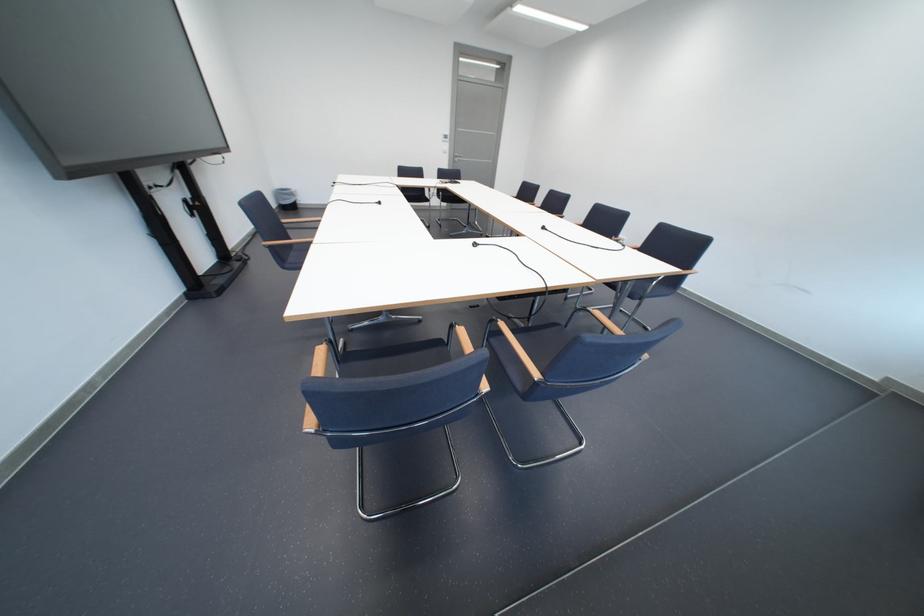
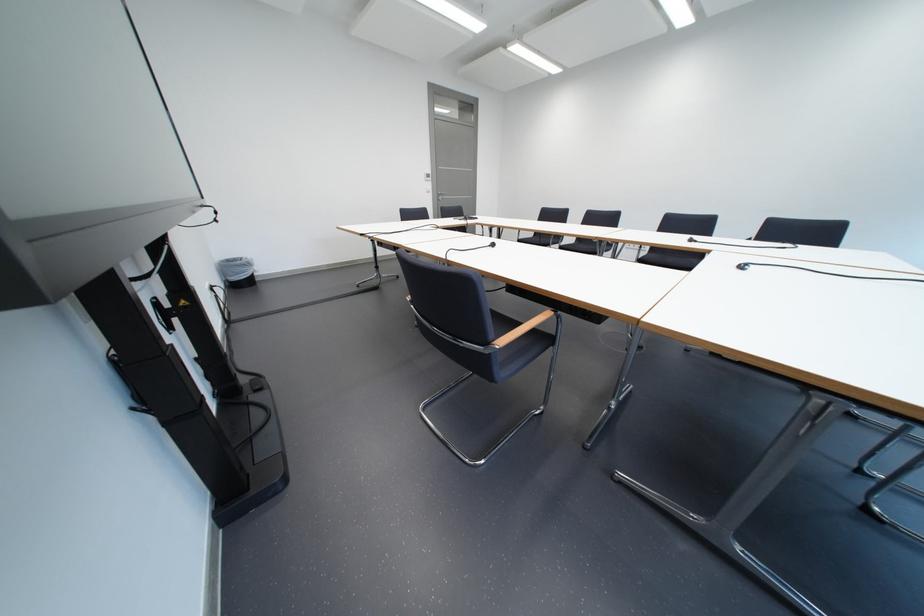
The images are taken continuously from a first-person perspective. In which direction are you moving?

The cameraman walked toward left, forward.